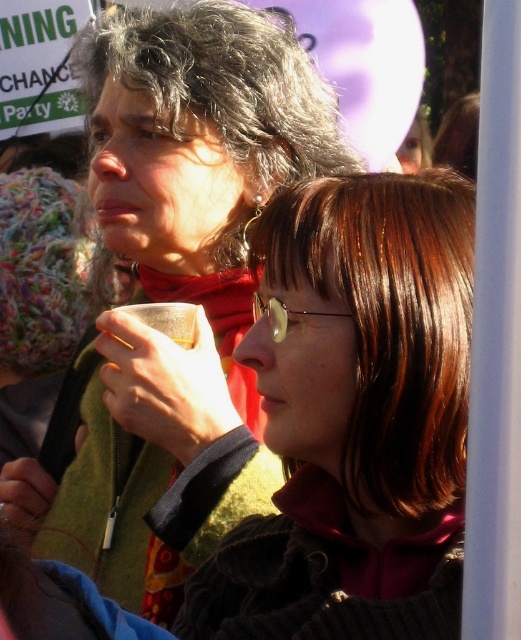
Between matte black jacket at upper center and brown hair at center, which one is positioned higher?

matte black jacket at upper center is higher up.

Locate an element on the screen. The height and width of the screenshot is (640, 521). matte black jacket at upper center is located at coordinates (173, 292).

Where is `matte black jacket at upper center`? matte black jacket at upper center is located at coordinates (173, 292).